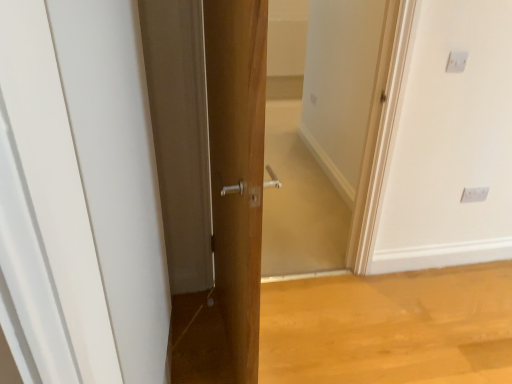
Question: Considering the positions of white plastic electric outlet at upper right, the 2th electric outlet when ordered from back to front, and white plastic electric outlet at upper right, which is the 2th electric outlet in left-to-right order, in the image, is white plastic electric outlet at upper right, the 2th electric outlet when ordered from back to front, taller or shorter than white plastic electric outlet at upper right, which is the 2th electric outlet in left-to-right order,?

Choices:
 (A) short
 (B) tall

Answer: (A)

Question: Considering their positions, is white plastic electric outlet at upper right, marked as the second electric outlet in a bottom-to-top arrangement, located in front of or behind white plastic electric outlet at upper right, placed as the first electric outlet when sorted from bottom to top?

Choices:
 (A) behind
 (B) front

Answer: (B)

Question: Estimate the real-world distances between objects in this image. Which object is farther from the white glossy door at center?

Choices:
 (A) white plastic electric outlet at upper right, placed as the second electric outlet when sorted from right to left
 (B) white plastic electric outlet at upper right, placed as the first electric outlet when sorted from bottom to top

Answer: (B)

Question: Which of these objects is positioned closest to the white glossy door at center?

Choices:
 (A) white plastic electric outlet at upper right, marked as the second electric outlet in a front-to-back arrangement
 (B) white plastic electric outlet at upper right, marked as the second electric outlet in a bottom-to-top arrangement

Answer: (B)